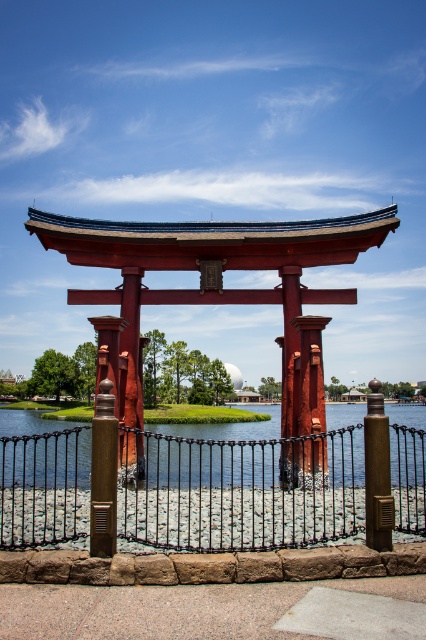
Question: Can you confirm if clear water at gate center is positioned below bronze/textured pole at center?

Choices:
 (A) yes
 (B) no

Answer: (A)

Question: Can you confirm if black wrought iron fence at center is bigger than bronze/textured pole at center?

Choices:
 (A) no
 (B) yes

Answer: (B)

Question: Which point appears farthest from the camera in this image?

Choices:
 (A) (351, 465)
 (B) (66, 518)
 (C) (371, 540)
 (D) (302, 333)

Answer: (A)

Question: Estimate the real-world distances between objects in this image. Which object is farther from the clear water at gate center?

Choices:
 (A) rustic wood pillar at center
 (B) black wrought iron fence at center

Answer: (A)

Question: Is clear water at gate center to the right of bronze/textured pole at center from the viewer's perspective?

Choices:
 (A) no
 (B) yes

Answer: (A)

Question: Considering the real-world distances, which object is farthest from the rustic wood pillar at center?

Choices:
 (A) black wrought iron fence at center
 (B) clear water at gate center

Answer: (B)